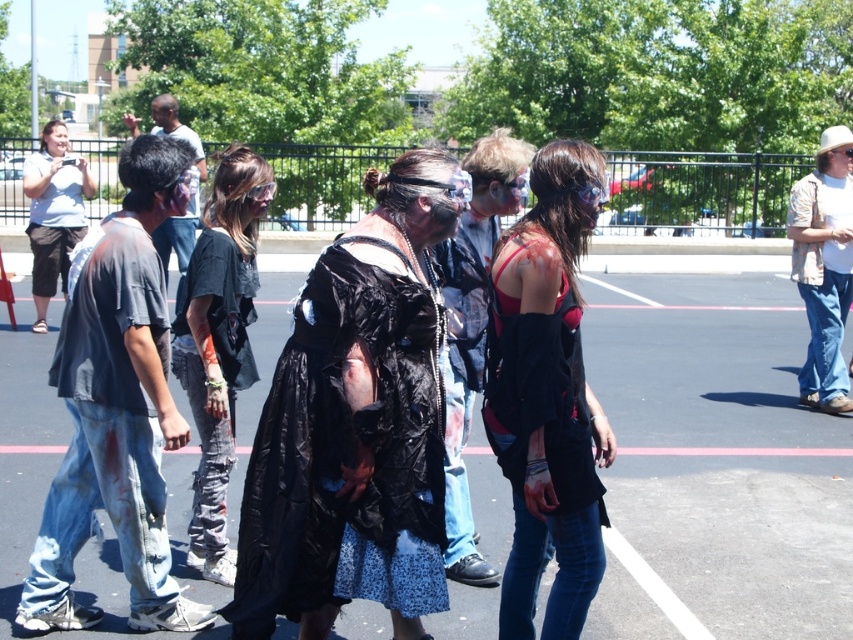
Question: In this image, where is matte black jacket at center located relative to matte black shirt at left?

Choices:
 (A) right
 (B) left

Answer: (A)

Question: Is denim jeans at left thinner than ripped denim pants at center?

Choices:
 (A) no
 (B) yes

Answer: (A)

Question: Which object is positioned closest to the matte black shirt at center?

Choices:
 (A) denim jeans at left
 (B) black plastic dress at center

Answer: (A)

Question: Which object is the farthest from the matte black vest at center?

Choices:
 (A) black plastic dress at center
 (B) black plastic bag at center
 (C) matte black shirt at left

Answer: (C)

Question: Which point appears closest to the camera in this image?

Choices:
 (A) (138, 540)
 (B) (235, 602)
 (C) (173, 122)

Answer: (B)

Question: Is denim jeans at left smaller than matte black shirt at left?

Choices:
 (A) yes
 (B) no

Answer: (B)